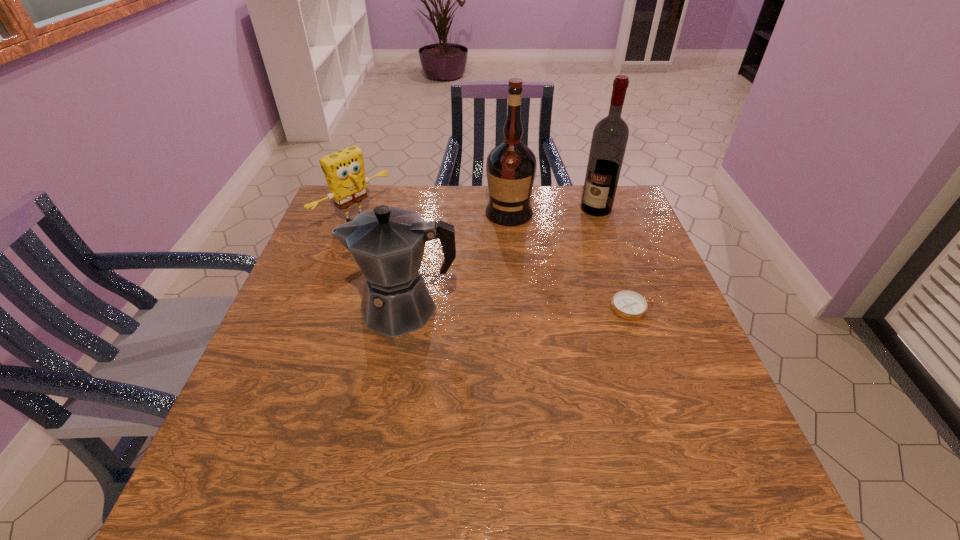
Where is `the third tallest object`? This screenshot has height=540, width=960. the third tallest object is located at coordinates (387, 243).

At what (x,y) coordinates should I click in order to perform the action: click on the shortest object. Please return your answer as a coordinate pair (x, y). The height and width of the screenshot is (540, 960). Looking at the image, I should click on [x=627, y=304].

Find the location of a particular element. The width and height of the screenshot is (960, 540). alcohol is located at coordinates (609, 140).

Locate an element on the screen. liquor is located at coordinates (511, 166).

The width and height of the screenshot is (960, 540). I want to click on sponge, so click(x=344, y=171).

This screenshot has width=960, height=540. Identify the location of vacant space located 0.160m at the spout of the coffeepot. (284, 308).

Where is `free space located at the spout of the coffeepot`? free space located at the spout of the coffeepot is located at coordinates (297, 308).

Locate an element on the screen. The width and height of the screenshot is (960, 540). vacant area situated 0.100m at the spout of the coffeepot is located at coordinates (309, 308).

The image size is (960, 540). In order to click on vacant area situated on the front of the shortest object in this screenshot , I will do `click(669, 410)`.

Find the location of `free space located on the front and back of the alcohol`. free space located on the front and back of the alcohol is located at coordinates (567, 250).